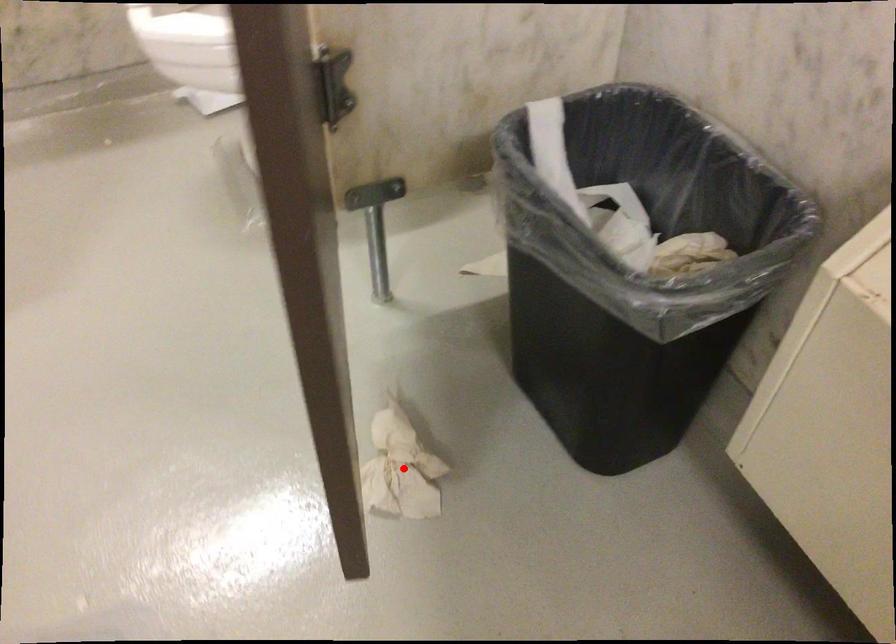
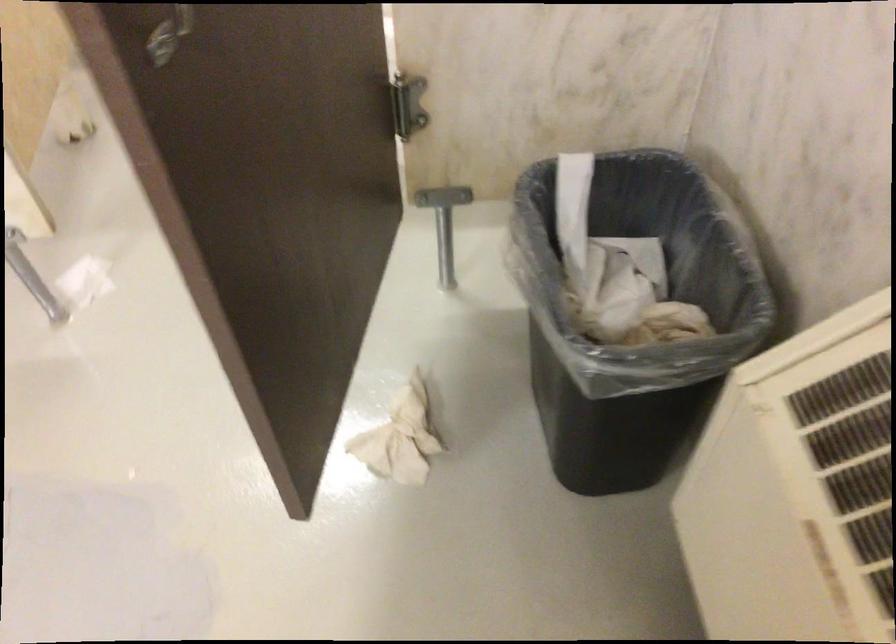
Locate, in the second image, the point that corresponds to the highlighted location in the first image.

(400, 438)